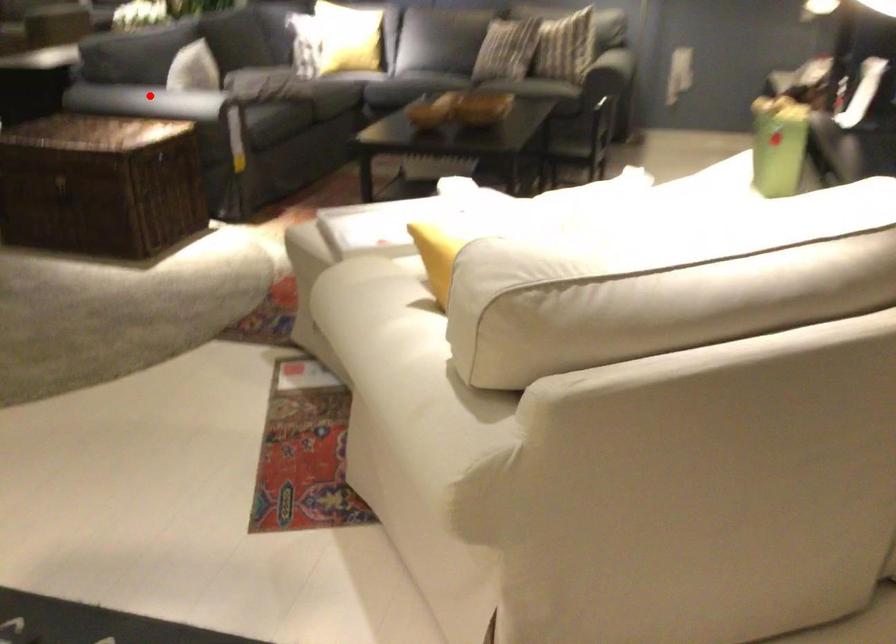
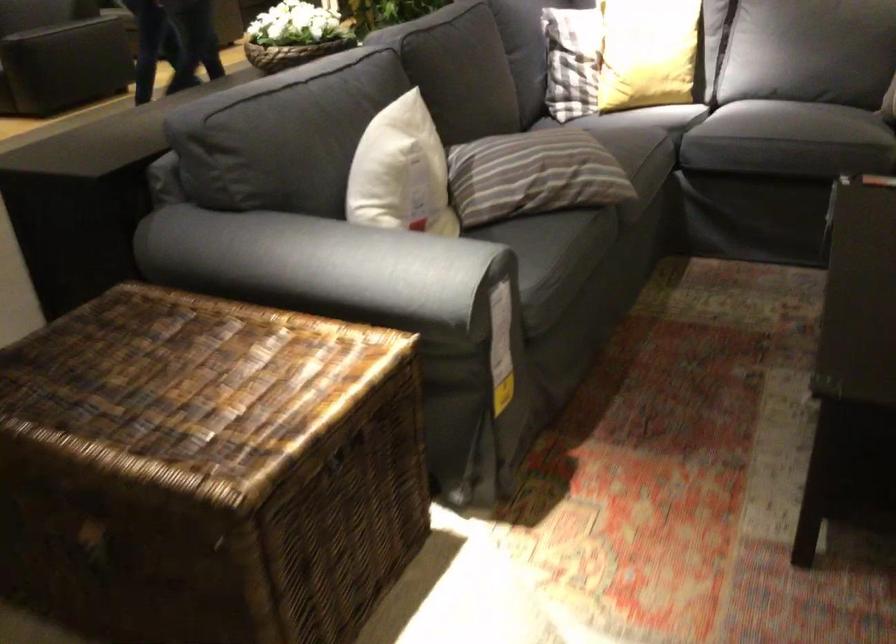
In the second image, find the point that corresponds to the highlighted location in the first image.

(304, 265)